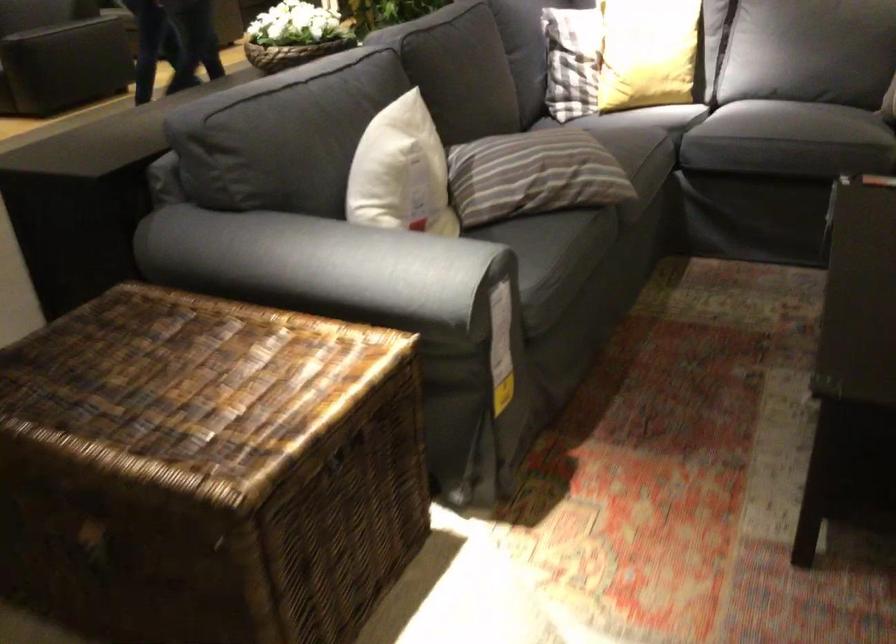
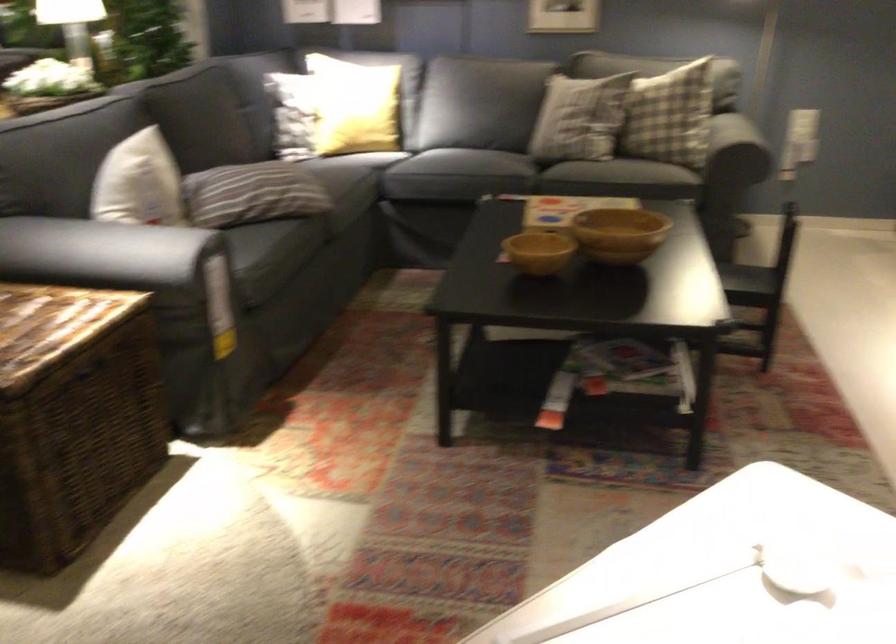
In the second image, find the point that corresponds to point 687,104 in the first image.

(386, 149)